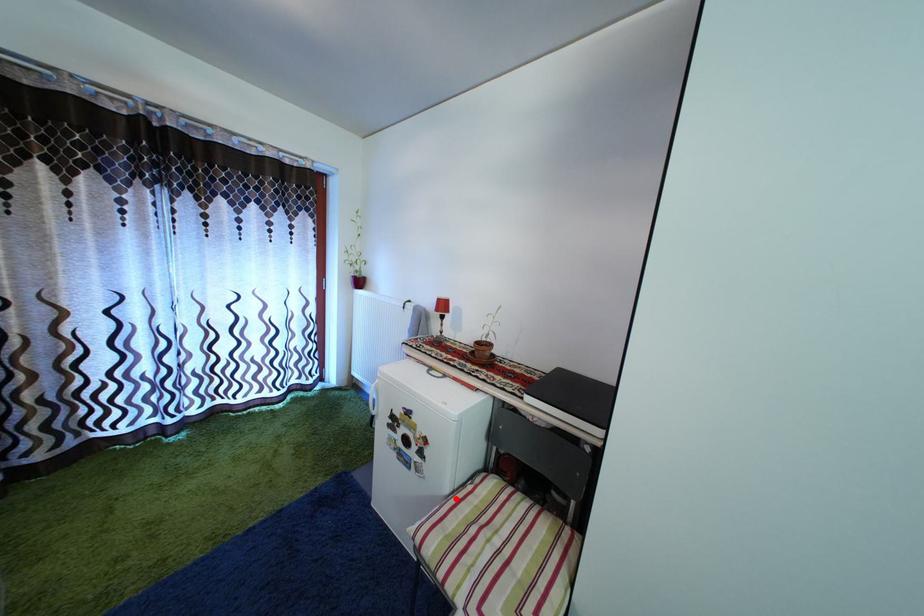
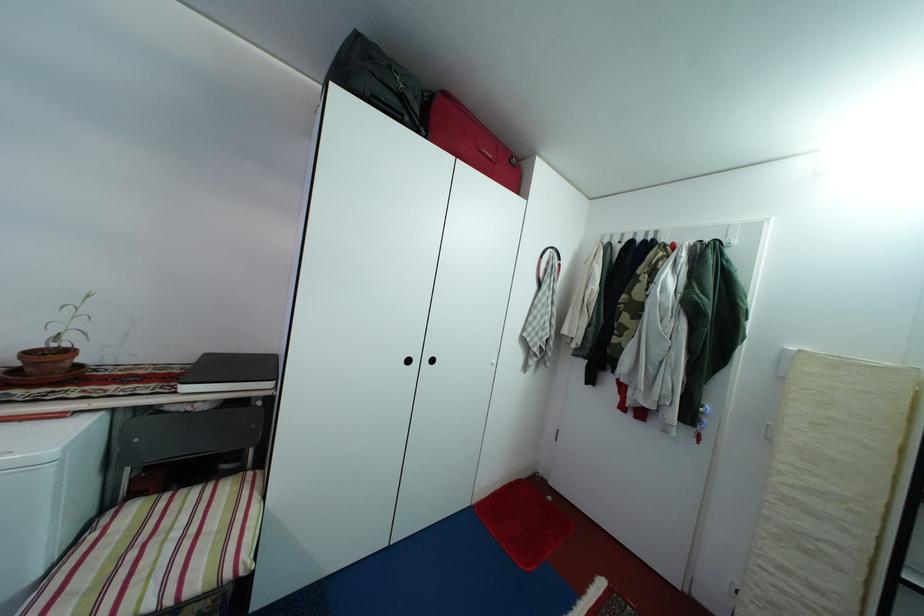
Question: I am providing you with two images of the same scene from different viewpoints. Image1 has a red point marked. In image2, the corresponding 3D location appears at what relative position? Reply with the corresponding letter.

Choices:
 (A) Closer
 (B) Farther

Answer: (A)